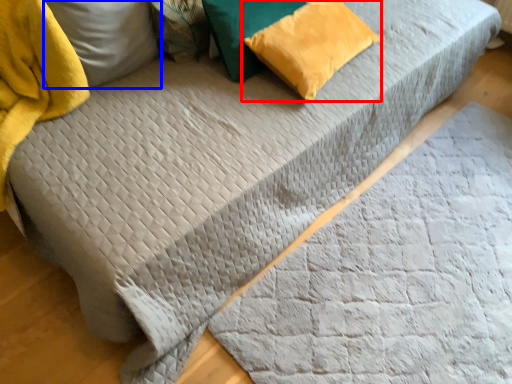
Question: Which object appears farthest to the camera in this image, pillow (highlighted by a red box) or pillow (highlighted by a blue box)?

Choices:
 (A) pillow
 (B) pillow

Answer: (A)